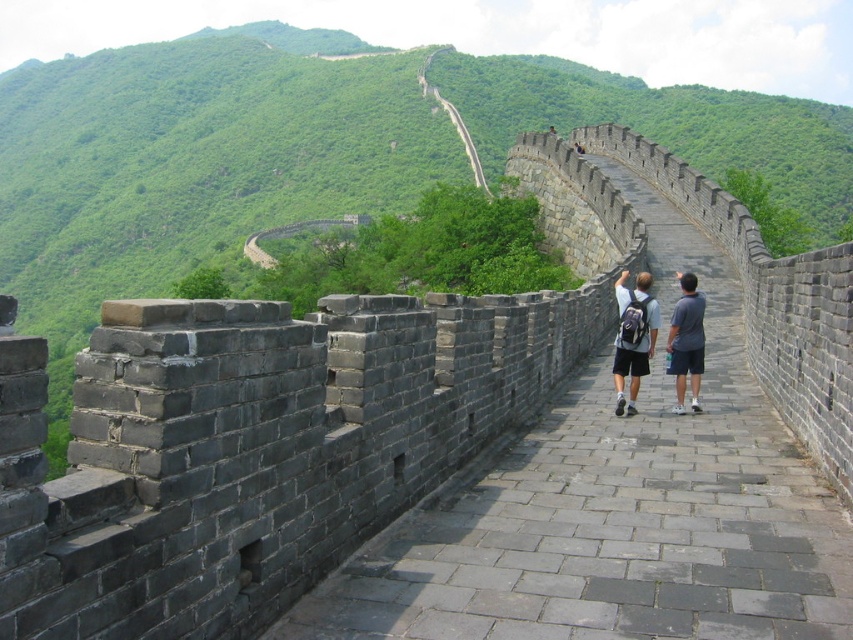
Question: Is matte gray backpack at center smaller than gray backpack at center?

Choices:
 (A) yes
 (B) no

Answer: (B)

Question: Which point is farther from the camera taking this photo?

Choices:
 (A) (654, 317)
 (B) (640, 292)

Answer: (B)

Question: Can you confirm if gray backpack at center is smaller than gray fabric shorts at center-right?

Choices:
 (A) yes
 (B) no

Answer: (A)

Question: Which object is closer to the camera taking this photo?

Choices:
 (A) gray fabric shorts at center-right
 (B) gray backpack at center

Answer: (B)

Question: Which point is farther to the camera?

Choices:
 (A) (679, 362)
 (B) (625, 346)

Answer: (B)

Question: Can you confirm if matte gray backpack at center is smaller than gray fabric shorts at center-right?

Choices:
 (A) no
 (B) yes

Answer: (A)